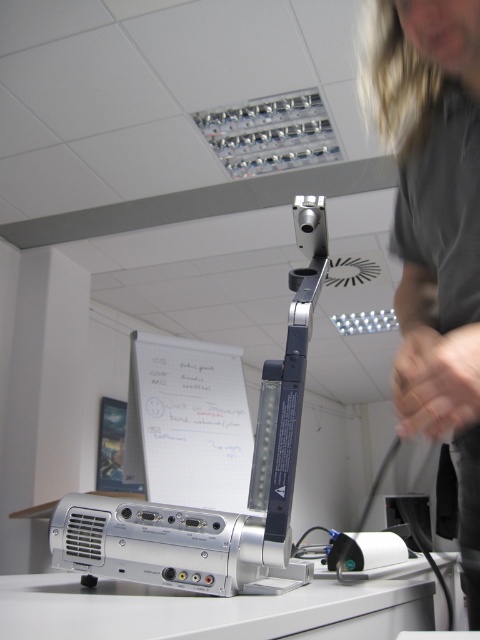
Which is more to the left, gray fabric shirt at upper right or silver metallic table at lower center?

Positioned to the left is silver metallic table at lower center.

How much distance is there between gray fabric shirt at upper right and silver metallic table at lower center?

16.96 inches

Between point (445, 113) and point (156, 595), which one is positioned behind?

The point (445, 113) is behind.

The height and width of the screenshot is (640, 480). I want to click on gray fabric shirt at upper right, so click(x=435, y=228).

Is silver metallic projector at lower center in front of silver metallic table at lower center?

No, silver metallic projector at lower center is further to the viewer.

Is silver metallic projector at lower center above silver metallic table at lower center?

Indeed, silver metallic projector at lower center is positioned over silver metallic table at lower center.

The height and width of the screenshot is (640, 480). What do you see at coordinates (210, 472) in the screenshot?
I see `silver metallic projector at lower center` at bounding box center [210, 472].

Where is `silver metallic projector at lower center`? The width and height of the screenshot is (480, 640). silver metallic projector at lower center is located at coordinates pos(210,472).

Who is more distant from viewer, [406,163] or [81,531]?

The point [406,163] is more distant.

What do you see at coordinates (435, 228) in the screenshot? This screenshot has width=480, height=640. I see `gray fabric shirt at upper right` at bounding box center [435, 228].

Where is `gray fabric shirt at upper right`? gray fabric shirt at upper right is located at coordinates (435, 228).